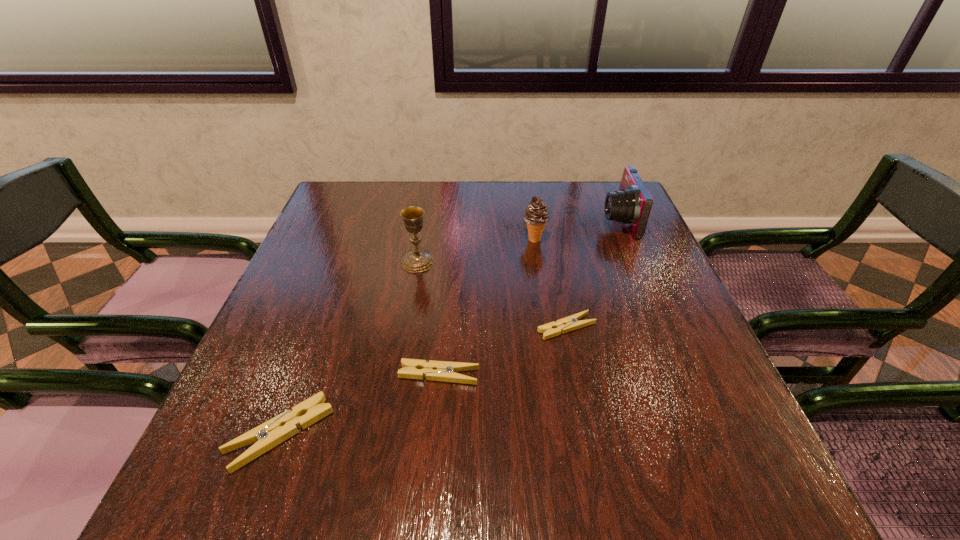
Select which object appears as the fourth closest to the fourth nearest object. Please provide its 2D coordinates. Your answer should be formatted as a tuple, i.e. [(x, y)], where the tuple contains the x and y coordinates of a point satisfying the conditions above.

[(268, 435)]

Select which object is the fourth closest to the icecream. Please provide its 2D coordinates. Your answer should be formatted as a tuple, i.e. [(x, y)], where the tuple contains the x and y coordinates of a point satisfying the conditions above.

[(444, 371)]

This screenshot has width=960, height=540. In order to click on the closest clothespin to the second nearest clothespin in this screenshot , I will do `click(268, 435)`.

At what (x,y) coordinates should I click in order to perform the action: click on the closest clothespin to the second shortest clothespin. Please return your answer as a coordinate pair (x, y). Looking at the image, I should click on (268, 435).

Locate an element on the screen. vacant area that satisfies the following two spatial constraints: 1. on the back side of the shortest clothespin; 2. on the left side of the second clothespin from right to left is located at coordinates (x=444, y=327).

Identify the location of free spot that satisfies the following two spatial constraints: 1. on the front-facing side of the rightmost object; 2. on the front side of the second shortest object. (683, 375).